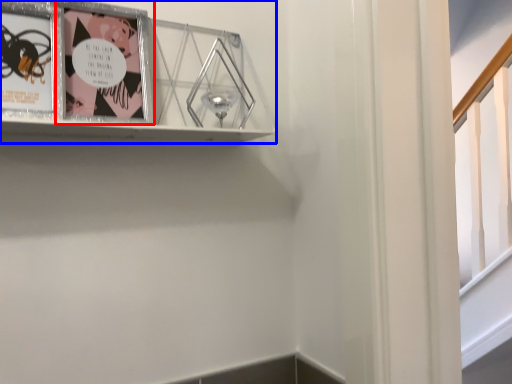
Question: Among these objects, which one is farthest to the camera, picture frame (highlighted by a red box) or picture frame (highlighted by a blue box)?

Choices:
 (A) picture frame
 (B) picture frame

Answer: (A)